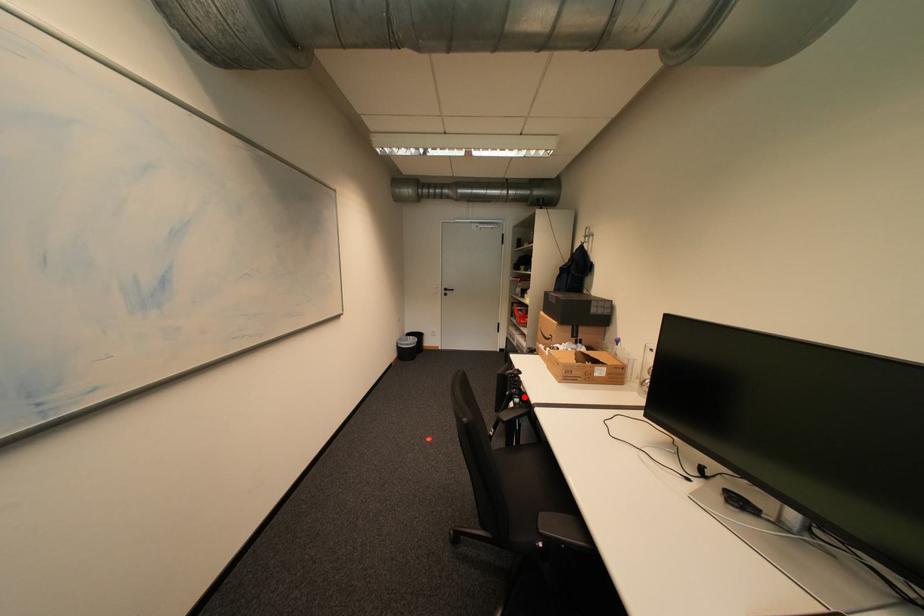
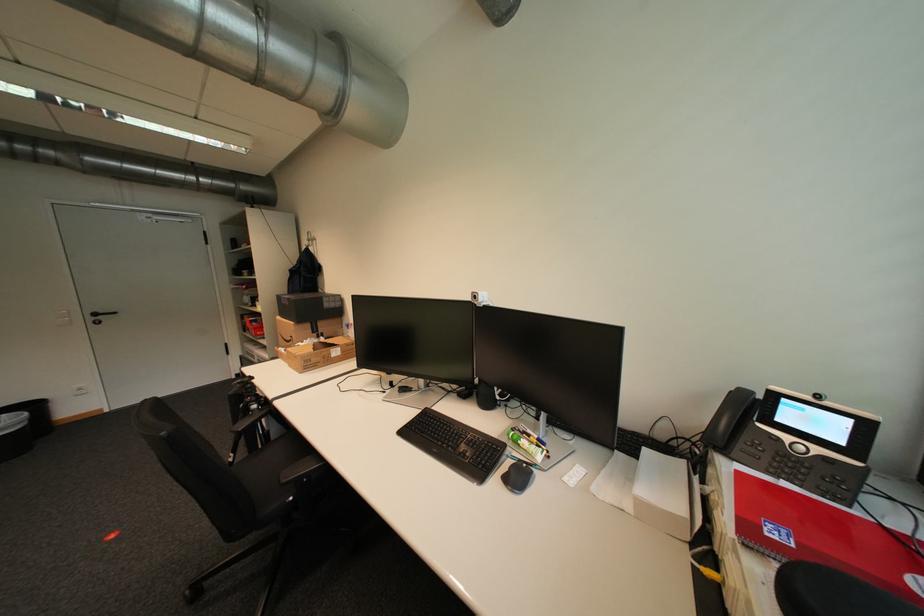
The point at the highlighted location is marked in the first image. Where is the corresponding point in the second image?

(261, 403)